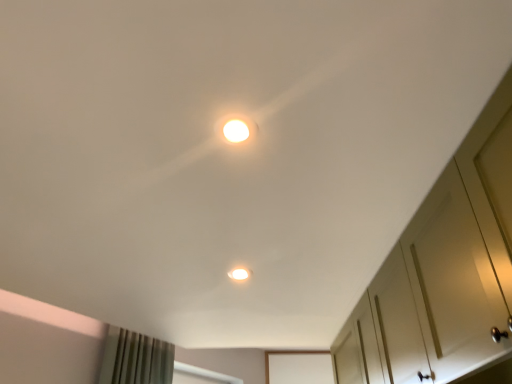
Where is `white matte cabinet at right`? This screenshot has width=512, height=384. white matte cabinet at right is located at coordinates (443, 272).

What do you see at coordinates (443, 272) in the screenshot?
I see `white matte cabinet at right` at bounding box center [443, 272].

In order to face white glossy light fixture at upper center, the first dot when ordered from top to bottom, should I rotate leftwards or rightwards?

Turn left by 2.311 degrees to look at white glossy light fixture at upper center, the first dot when ordered from top to bottom.

The image size is (512, 384). I want to click on white matte cabinet at right, so click(443, 272).

Are matte white light at center, the 2th dot in the front-to-back sequence, and white glossy light fixture at upper center, the second dot from the back, located far from each other?

They are positioned close to each other.

Based on the photo, could you tell me if matte white light at center, the second dot viewed from the top, is facing white glossy light fixture at upper center, the first dot when ordered from top to bottom?

No.

Between matte white light at center, marked as the first dot in a back-to-front arrangement, and white glossy light fixture at upper center, the first dot viewed from the front, which one has more height?

matte white light at center, marked as the first dot in a back-to-front arrangement, is taller.

Where is `dot that is on the right side of matte white light at center, the 2th dot in the front-to-back sequence`? This screenshot has height=384, width=512. dot that is on the right side of matte white light at center, the 2th dot in the front-to-back sequence is located at coordinates (236, 128).

Is white matte cabinet at right smaller than white glossy light fixture at upper center, positioned as the 2th dot in bottom-to-top order?

Incorrect, white matte cabinet at right is not smaller in size than white glossy light fixture at upper center, positioned as the 2th dot in bottom-to-top order.

Does white matte cabinet at right turn towards white glossy light fixture at upper center, positioned as the 2th dot in bottom-to-top order?

Yes, white matte cabinet at right faces towards white glossy light fixture at upper center, positioned as the 2th dot in bottom-to-top order.

Is point (419, 314) behind point (233, 119)?

Yes, point (419, 314) is behind point (233, 119).

Is the position of white matte cabinet at right less distant than that of white glossy light fixture at upper center, the first dot viewed from the front?

Yes, white matte cabinet at right is in front of white glossy light fixture at upper center, the first dot viewed from the front.

Considering the points (230, 277) and (483, 151), which point is in front, point (230, 277) or point (483, 151)?

Positioned in front is point (483, 151).

How different are the orientations of matte white light at center, the second dot viewed from the top, and white matte cabinet at right in degrees?

The facing directions of matte white light at center, the second dot viewed from the top, and white matte cabinet at right are 0.000194 degrees apart.

Would you say matte white light at center, the 2th dot in the front-to-back sequence, is outside white matte cabinet at right?

matte white light at center, the 2th dot in the front-to-back sequence, is positioned outside white matte cabinet at right.

Which object is positioned more to the left, matte white light at center, the second dot viewed from the top, or white matte cabinet at right?

matte white light at center, the second dot viewed from the top, is more to the left.

Is point (239, 138) positioned in front of point (243, 274)?

Yes, point (239, 138) is closer to viewer.

From a real-world perspective, between white glossy light fixture at upper center, positioned as the 2th dot in bottom-to-top order, and matte white light at center, the 2th dot in the front-to-back sequence, who is vertically lower?

white glossy light fixture at upper center, positioned as the 2th dot in bottom-to-top order.

Who is taller, white glossy light fixture at upper center, the first dot when ordered from top to bottom, or matte white light at center, marked as the first dot in a back-to-front arrangement?

matte white light at center, marked as the first dot in a back-to-front arrangement, is taller.

Between white glossy light fixture at upper center, positioned as the 2th dot in bottom-to-top order, and matte white light at center, the 2th dot in the front-to-back sequence, which one appears on the right side from the viewer's perspective?

Positioned to the right is white glossy light fixture at upper center, positioned as the 2th dot in bottom-to-top order.

Could you tell me if white matte cabinet at right is facing matte white light at center, marked as the first dot in a back-to-front arrangement?

Yes, white matte cabinet at right is oriented towards matte white light at center, marked as the first dot in a back-to-front arrangement.

Can you tell me how much white matte cabinet at right and matte white light at center, marked as the first dot in a back-to-front arrangement, differ in facing direction?

The angular difference between white matte cabinet at right and matte white light at center, marked as the first dot in a back-to-front arrangement, is 0.000194 degrees.

Can you see white matte cabinet at right touching matte white light at center, marked as the 1th dot in a bottom-to-top arrangement?

white matte cabinet at right and matte white light at center, marked as the 1th dot in a bottom-to-top arrangement, are clearly separated.

Which point is more forward, (415, 310) or (245, 272)?

The point (415, 310) is closer to the camera.

From the image's perspective, is white glossy light fixture at upper center, the second dot from the back, above white matte cabinet at right?

Yes.

From a real-world perspective, is white glossy light fixture at upper center, positioned as the 2th dot in bottom-to-top order, physically located above or below white matte cabinet at right?

white glossy light fixture at upper center, positioned as the 2th dot in bottom-to-top order, is situated higher than white matte cabinet at right in the real world.

Which object is further away from the camera taking this photo, white glossy light fixture at upper center, the second dot from the back, or white matte cabinet at right?

white glossy light fixture at upper center, the second dot from the back, is behind.

Considering the sizes of objects white glossy light fixture at upper center, positioned as the 2th dot in bottom-to-top order, and white matte cabinet at right in the image provided, who is wider, white glossy light fixture at upper center, positioned as the 2th dot in bottom-to-top order, or white matte cabinet at right?

white matte cabinet at right is wider.

Identify the location of dot lying in front of the matte white light at center, the second dot viewed from the top. Image resolution: width=512 pixels, height=384 pixels. (236, 128).

This screenshot has height=384, width=512. Find the location of `the 1st dot to the left of the white matte cabinet at right, counting from the anchor's position`. the 1st dot to the left of the white matte cabinet at right, counting from the anchor's position is located at coordinates (236, 128).

Looking at the image, which one is located closer to matte white light at center, marked as the 1th dot in a bottom-to-top arrangement, white glossy light fixture at upper center, the first dot when ordered from top to bottom, or white matte cabinet at right?

white matte cabinet at right lies closer to matte white light at center, marked as the 1th dot in a bottom-to-top arrangement, than the other object.

When comparing their distances from white matte cabinet at right, does white glossy light fixture at upper center, the first dot when ordered from top to bottom, or matte white light at center, marked as the first dot in a back-to-front arrangement, seem closer?

matte white light at center, marked as the first dot in a back-to-front arrangement, is positioned closer to the anchor white matte cabinet at right.

Based on their spatial positions, is white matte cabinet at right or white glossy light fixture at upper center, the first dot viewed from the front, further from matte white light at center, the second dot viewed from the top?

Among the two, white glossy light fixture at upper center, the first dot viewed from the front, is located further to matte white light at center, the second dot viewed from the top.

From the image, which object appears to be farther from white matte cabinet at right, matte white light at center, the second dot viewed from the top, or white glossy light fixture at upper center, the first dot when ordered from top to bottom?

Among the two, white glossy light fixture at upper center, the first dot when ordered from top to bottom, is located further to white matte cabinet at right.

Which object lies nearer to the anchor point white glossy light fixture at upper center, the first dot viewed from the front, white matte cabinet at right or matte white light at center, marked as the first dot in a back-to-front arrangement?

Based on the image, white matte cabinet at right appears to be nearer to white glossy light fixture at upper center, the first dot viewed from the front.

Which object lies nearer to the anchor point white glossy light fixture at upper center, positioned as the 2th dot in bottom-to-top order, matte white light at center, the second dot viewed from the top, or white matte cabinet at right?

white matte cabinet at right is closer to white glossy light fixture at upper center, positioned as the 2th dot in bottom-to-top order.

The image size is (512, 384). I want to click on dot between white matte cabinet at right and matte white light at center, marked as the 1th dot in a bottom-to-top arrangement, along the z-axis, so click(x=236, y=128).